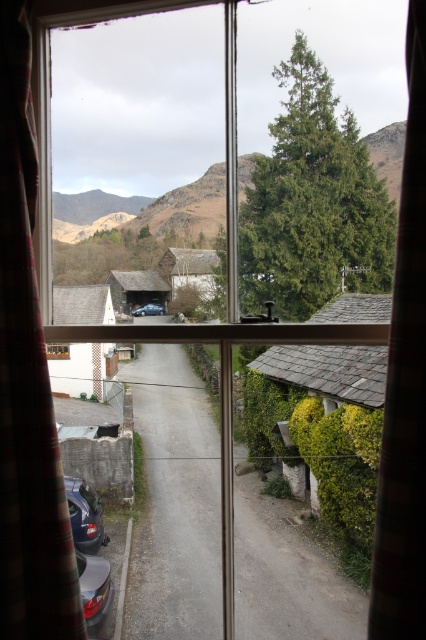
Question: Among these objects, which one is farthest from the camera?

Choices:
 (A) metallic blue car at lower left
 (B) metallic blue car at center
 (C) plaid fabric curtain at right

Answer: (B)

Question: Does plaid fabric curtain at right appear on the left side of metallic blue car at lower left?

Choices:
 (A) no
 (B) yes

Answer: (A)

Question: Which point is farther to the camera?

Choices:
 (A) (85, 609)
 (B) (144, 308)

Answer: (B)

Question: Is metallic blue car at lower left above metallic blue car at center?

Choices:
 (A) no
 (B) yes

Answer: (A)

Question: Which object appears farthest from the camera in this image?

Choices:
 (A) metallic silver car at lower left
 (B) plaid fabric curtain at left
 (C) metallic blue car at center
 (D) plaid fabric curtain at right

Answer: (C)

Question: Is plaid fabric curtain at left above green textured tree at upper right?

Choices:
 (A) no
 (B) yes

Answer: (A)